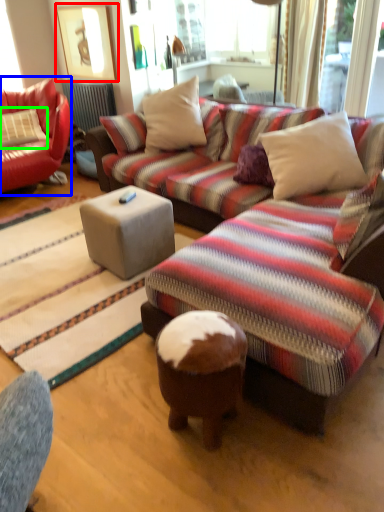
Question: Considering the real-world distances, which object is closest to picture frame (highlighted by a red box)? studio couch (highlighted by a blue box) or pillow (highlighted by a green box).

Choices:
 (A) studio couch
 (B) pillow

Answer: (A)